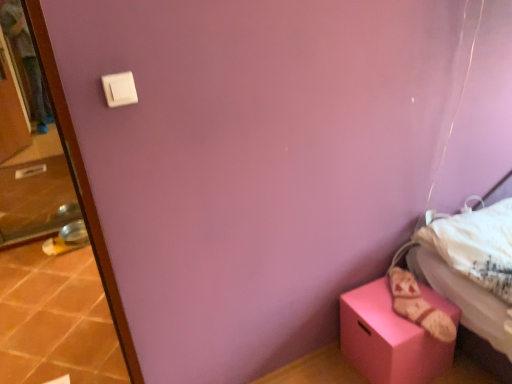
The width and height of the screenshot is (512, 384). I want to click on vacant area on top of terracotta tile at lower left (from a real-world perspective), so click(x=44, y=309).